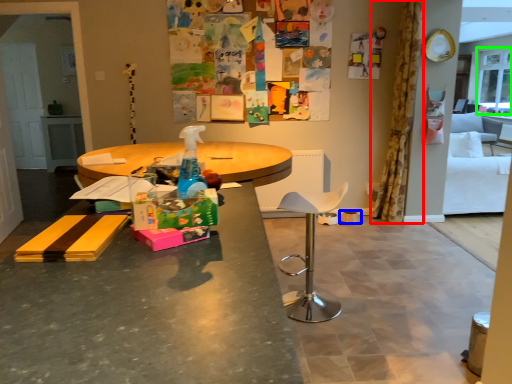
Question: Estimate the real-world distances between objects in this image. Which object is farther from curtain (highlighted by a red box), bowl (highlighted by a blue box) or window screen (highlighted by a green box)?

Choices:
 (A) bowl
 (B) window screen

Answer: (B)